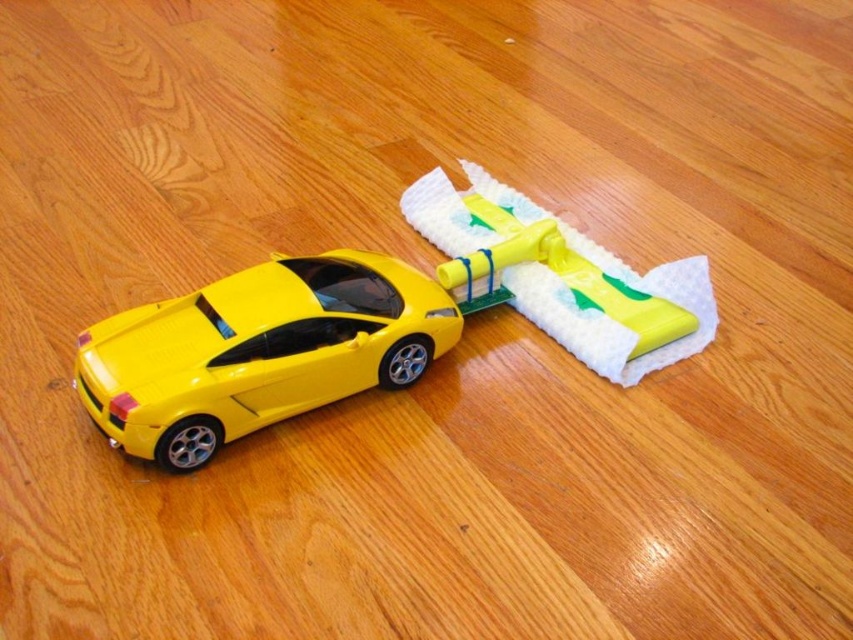
Question: Can you confirm if yellow matte car at center is bigger than yellow glossy car at center?

Choices:
 (A) no
 (B) yes

Answer: (B)

Question: Estimate the real-world distances between objects in this image. Which object is closer to the yellow matte/matte plastic toy car at upper center?

Choices:
 (A) yellow glossy car at center
 (B) yellow matte car at center

Answer: (B)

Question: Can you confirm if yellow matte car at center is positioned to the left of yellow matte/matte plastic toy car at upper center?

Choices:
 (A) yes
 (B) no

Answer: (A)

Question: Is yellow matte car at center wider than yellow matte/matte plastic toy car at upper center?

Choices:
 (A) yes
 (B) no

Answer: (A)

Question: Among these points, which one is nearest to the camera?

Choices:
 (A) (194, 301)
 (B) (184, 333)

Answer: (B)

Question: Which of the following is the closest to the observer?

Choices:
 (A) yellow matte car at center
 (B) yellow glossy car at center
 (C) yellow matte/matte plastic toy car at upper center

Answer: (B)